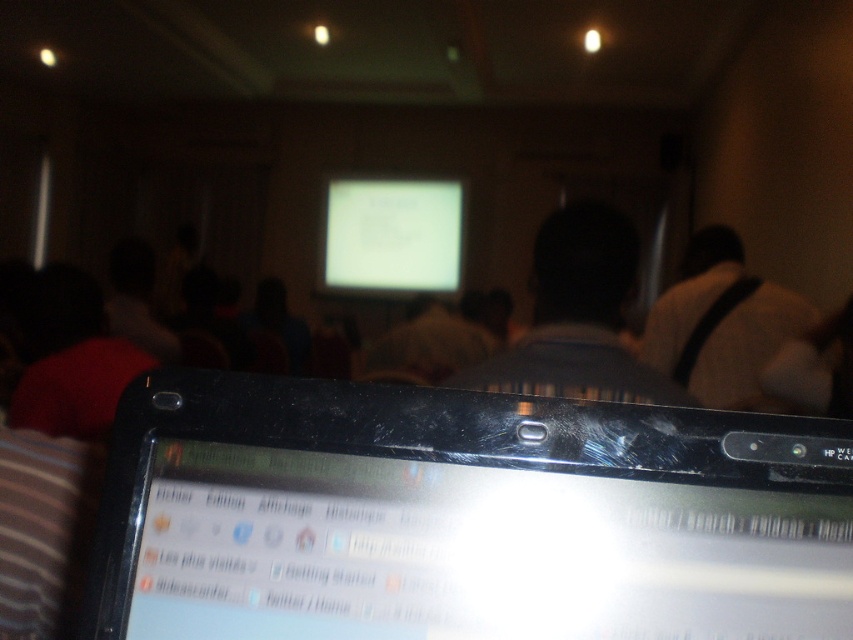
The height and width of the screenshot is (640, 853). What are the coordinates of `black plastic laptop at bottom` in the screenshot? It's located at (462, 516).

Between point (421, 636) and point (703, 284), which one is positioned in front?

Point (421, 636) is more forward.

This screenshot has width=853, height=640. What are the coordinates of `black plastic laptop at bottom` in the screenshot? It's located at (462, 516).

Does black plastic laptop at bottom have a larger size compared to matte black laptop at center?

No.

Can you confirm if black plastic laptop at bottom is thinner than matte black laptop at center?

Yes, black plastic laptop at bottom is thinner than matte black laptop at center.

Which is in front, point (415, 419) or point (552, 228)?

Point (415, 419) is in front.

Identify the location of black plastic laptop at bottom. This screenshot has height=640, width=853. (462, 516).

Which is above, matte black laptop at center or white glossy screen at center?

white glossy screen at center

Who is positioned more to the left, matte black laptop at center or white glossy screen at center?

From the viewer's perspective, white glossy screen at center appears more on the left side.

Is point (550, 257) closer to viewer compared to point (363, 180)?

Yes.

The image size is (853, 640). Find the location of `matte black laptop at center`. matte black laptop at center is located at coordinates (577, 317).